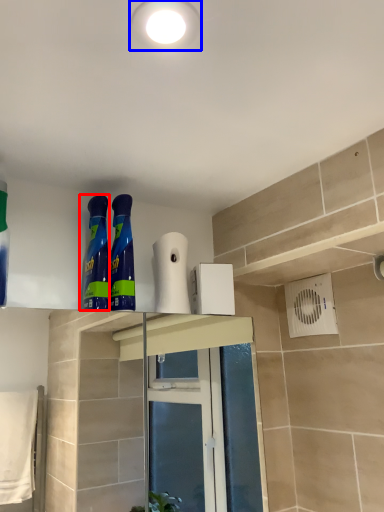
Question: Which of the following is the closest to the observer, cleaning product (highlighted by a red box) or lighting (highlighted by a blue box)?

Choices:
 (A) cleaning product
 (B) lighting

Answer: (B)